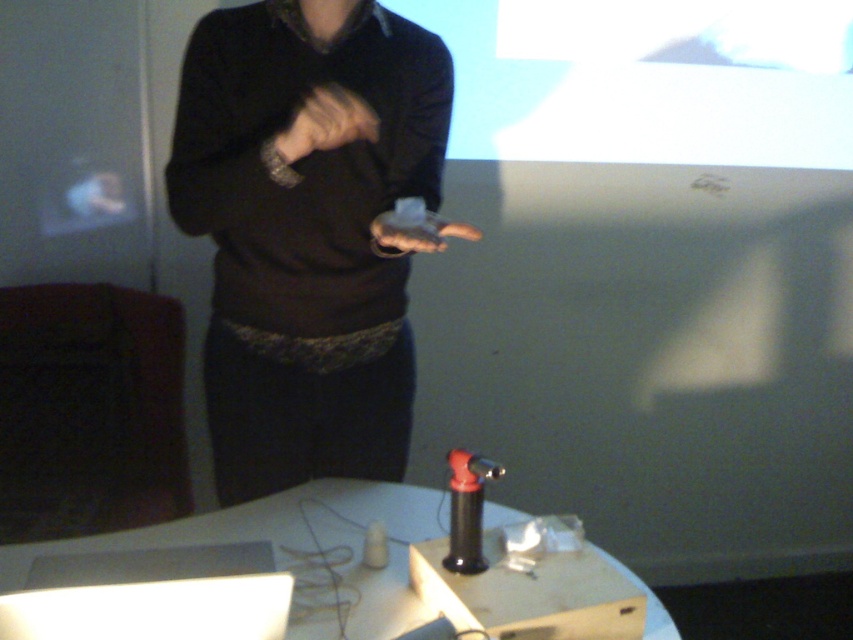
You are organizing items on a table for an event. You have a white cardboard box at center and a black matte tool at lower center. Which item should you place closer to the edge of the table to ensure there is enough space for both?

The white cardboard box at center might be wider than the black matte tool at lower center, so placing the wider white cardboard box at center closer to the edge would allow more space for the narrower black matte tool at lower center.

Consider the image. You are an assistant at a science fair booth. You need to place a new item on the table. The current items are the white cardboard box at center and the matte black hand at center. According to the spatial arrangement, where should you place the new item so that it is between these two objects?

The new item should be placed between the white cardboard box at center and the matte black hand at center, positioning it to the left of the white cardboard box at center and to the right of the matte black hand at center since the white cardboard box is to the right of the matte black hand.